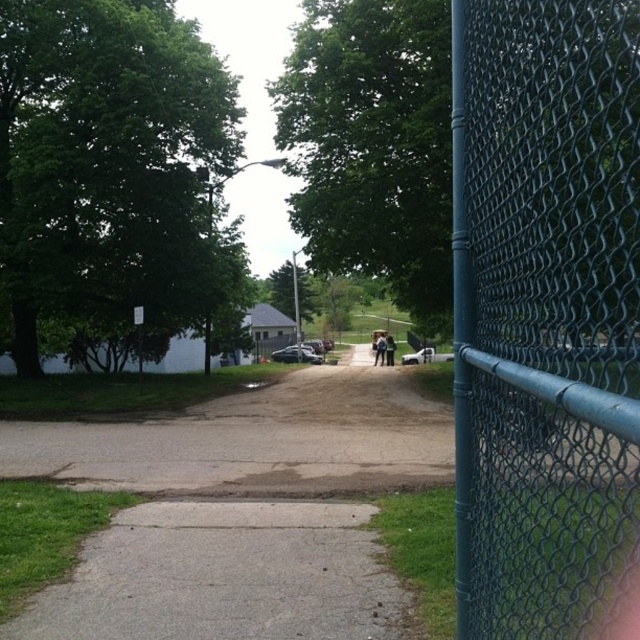
You are standing on the pathway and see two people wearing light blue jeans at center and dark blue jeans at center. Which person is closer to you?

The light blue jeans at center is closer to you because it is further to the viewer than dark blue jeans at center.